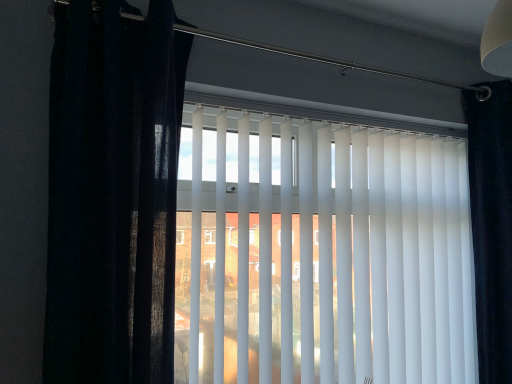
Question: Does black velvet curtain at right, the 1th curtain from the back, have a larger size compared to matte black curtain at left, marked as the first curtain in a left-to-right arrangement?

Choices:
 (A) yes
 (B) no

Answer: (B)

Question: From the image's perspective, is black velvet curtain at right, the 1th curtain from the back, below matte black curtain at left, which is the 1th curtain in front-to-back order?

Choices:
 (A) yes
 (B) no

Answer: (A)

Question: Could you tell me if black velvet curtain at right, the second curtain in the front-to-back sequence, is facing matte black curtain at left, marked as the first curtain in a left-to-right arrangement?

Choices:
 (A) no
 (B) yes

Answer: (A)

Question: Does black velvet curtain at right, acting as the second curtain starting from the left, lie in front of matte black curtain at left, marked as the first curtain in a left-to-right arrangement?

Choices:
 (A) no
 (B) yes

Answer: (A)

Question: Is black velvet curtain at right, acting as the second curtain starting from the left, shorter than matte black curtain at left, which is the 1th curtain in front-to-back order?

Choices:
 (A) yes
 (B) no

Answer: (B)

Question: Is black velvet curtain at right, acting as the second curtain starting from the left, taller or shorter than white matte vertical blinds at center?

Choices:
 (A) short
 (B) tall

Answer: (B)

Question: Is point (492, 327) closer or farther from the camera than point (276, 349)?

Choices:
 (A) closer
 (B) farther

Answer: (B)

Question: From a real-world perspective, relative to white matte vertical blinds at center, is black velvet curtain at right, acting as the second curtain starting from the left, vertically above or below?

Choices:
 (A) below
 (B) above

Answer: (B)

Question: Which is correct: black velvet curtain at right, acting as the second curtain starting from the left, is inside white matte vertical blinds at center, or outside of it?

Choices:
 (A) outside
 (B) inside

Answer: (A)

Question: From a real-world perspective, is white matte vertical blinds at center above or below black velvet curtain at right, positioned as the first curtain in right-to-left order?

Choices:
 (A) below
 (B) above

Answer: (A)

Question: Is point (199, 235) closer or farther from the camera than point (508, 264)?

Choices:
 (A) closer
 (B) farther

Answer: (A)

Question: From the image's perspective, is white matte vertical blinds at center above or below black velvet curtain at right, positioned as the first curtain in right-to-left order?

Choices:
 (A) below
 (B) above

Answer: (A)

Question: In terms of height, does white matte vertical blinds at center look taller or shorter compared to black velvet curtain at right, the 1th curtain from the back?

Choices:
 (A) tall
 (B) short

Answer: (B)

Question: Is matte black curtain at left, positioned as the second curtain in right-to-left order, spatially inside white matte vertical blinds at center, or outside of it?

Choices:
 (A) outside
 (B) inside

Answer: (A)

Question: Relative to white matte vertical blinds at center, is matte black curtain at left, acting as the second curtain starting from the back, in front or behind?

Choices:
 (A) front
 (B) behind

Answer: (A)